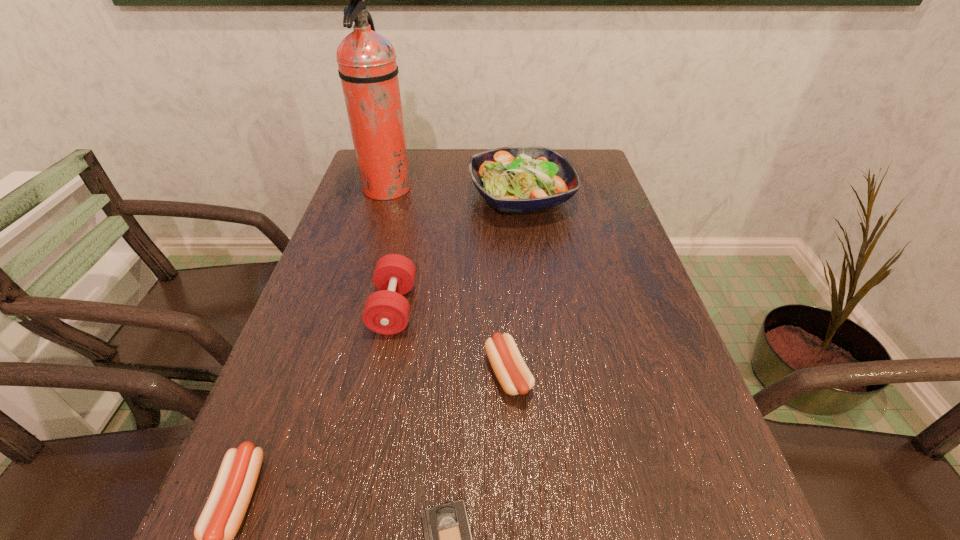
Where is `free space at the far right corner`? This screenshot has height=540, width=960. free space at the far right corner is located at coordinates (582, 151).

Find the location of a particular element. This screenshot has height=540, width=960. unoccupied position between the fourth nearest object and the second tallest object is located at coordinates (457, 253).

Where is `empty space between the fourth shortest object and the farther sausage`? This screenshot has width=960, height=540. empty space between the fourth shortest object and the farther sausage is located at coordinates (451, 341).

This screenshot has height=540, width=960. Identify the location of the fourth closest object to the salad plate. (223, 513).

Point out which object is positioned as the second nearest to the fire extinguisher. Please provide its 2D coordinates. Your answer should be formatted as a tuple, i.e. [(x, y)], where the tuple contains the x and y coordinates of a point satisfying the conditions above.

[(386, 311)]

I want to click on free space that satisfies the following two spatial constraints: 1. at the nozzle of the second tallest object; 2. on the left side of the tallest object, so click(384, 198).

You are a GUI agent. You are given a task and a screenshot of the screen. Output one action in this format:
    pyautogui.click(x=<x>, y=<y>)
    Task: Click on the blank area in the image that satisfies the following two spatial constraints: 1. at the nozzle of the fourth shortest object; 2. on the left side of the fire extinguisher
    The image size is (960, 540).
    Given the screenshot: What is the action you would take?
    tap(350, 308)

What are the coordinates of `blank area in the image that satisfies the following two spatial constraints: 1. on the back side of the dumbbell; 2. at the nozzle of the tallest object` in the screenshot? It's located at (418, 190).

Where is `free location that satisfies the following two spatial constraints: 1. at the nozzle of the tallest object; 2. on the back side of the fourth shortest object`? free location that satisfies the following two spatial constraints: 1. at the nozzle of the tallest object; 2. on the back side of the fourth shortest object is located at coordinates (350, 308).

Where is `blank area in the image that satisfies the following two spatial constraints: 1. at the nozzle of the tallest object; 2. on the back side of the third nearest object`? blank area in the image that satisfies the following two spatial constraints: 1. at the nozzle of the tallest object; 2. on the back side of the third nearest object is located at coordinates (331, 374).